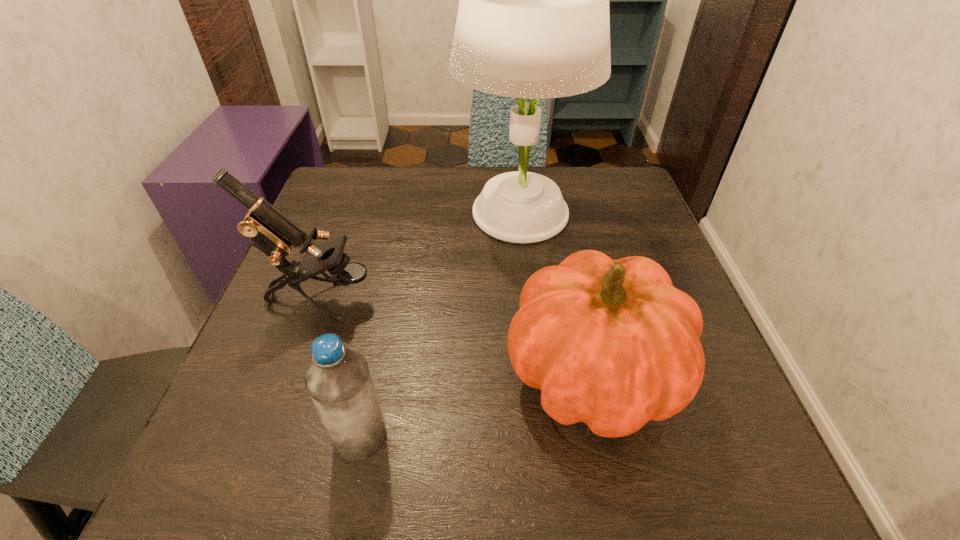
Locate an element on the screen. The width and height of the screenshot is (960, 540). free space located 0.290m on the right of the shortest object is located at coordinates (580, 437).

This screenshot has width=960, height=540. I want to click on object located in the far edge section of the desktop, so click(x=533, y=22).

At what (x,y) coordinates should I click in order to perform the action: click on pumpkin at the near edge. Please return your answer as a coordinate pair (x, y). The height and width of the screenshot is (540, 960). Looking at the image, I should click on (612, 343).

You are a GUI agent. You are given a task and a screenshot of the screen. Output one action in this format:
    pyautogui.click(x=<x>, y=<y>)
    Task: Click on the water bottle at the near edge
    The height and width of the screenshot is (540, 960).
    Given the screenshot: What is the action you would take?
    pyautogui.click(x=338, y=380)

Locate an element on the screen. object that is at the left edge is located at coordinates (270, 231).

I want to click on lamp located at the right edge, so click(533, 22).

Identify the location of pumpkin positioned at the right edge. This screenshot has width=960, height=540. (612, 343).

Find the location of `object at the far right corner`. object at the far right corner is located at coordinates (533, 22).

You are a GUI agent. You are given a task and a screenshot of the screen. Output one action in this format:
    pyautogui.click(x=<x>, y=<y>)
    Task: Click on the object that is positioned at the near right corner
    The height and width of the screenshot is (540, 960).
    Given the screenshot: What is the action you would take?
    pyautogui.click(x=612, y=343)

Find the location of a particular element. free location at the far edge of the desktop is located at coordinates (471, 166).